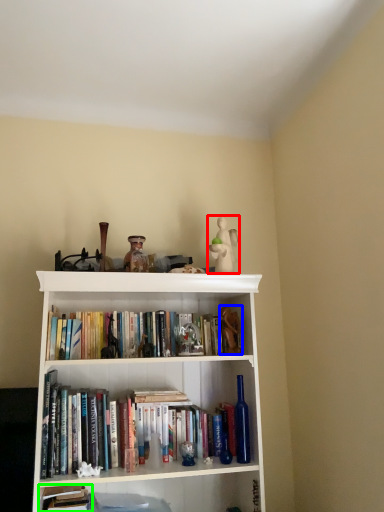
Question: Based on their relative distances, which object is farther from toy (highlighted by a red box)? Choose from toy (highlighted by a blue box) and book (highlighted by a green box).

Choices:
 (A) toy
 (B) book

Answer: (B)